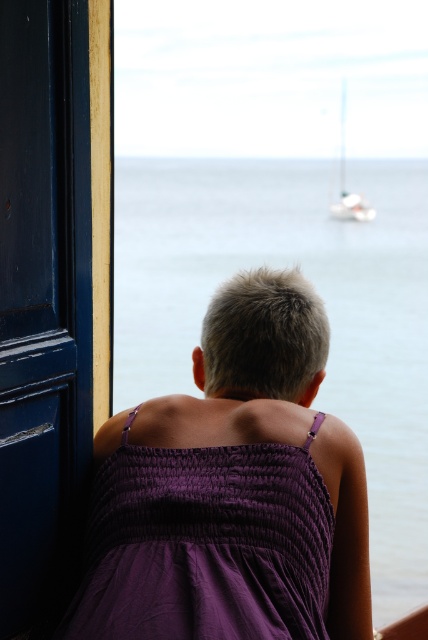
You are a photographer who wants to take a photo of the purple satin dress at center and the white glossy sailboat at upper right together in the same frame. Based on their distance, will the photographer need to adjust the zoom to include both subjects?

The purple satin dress at center and white glossy sailboat at upper right are 15.56 meters apart from each other. To include both in the same frame, the photographer would need to adjust the zoom to a wider angle to accommodate the distance between them.

You are standing inside the room looking out the window. There is a point marked at coordinates (x=231, y=490). What object is located at that point?

The point at coordinates (x=231, y=490) marks the purple satin dress at center.